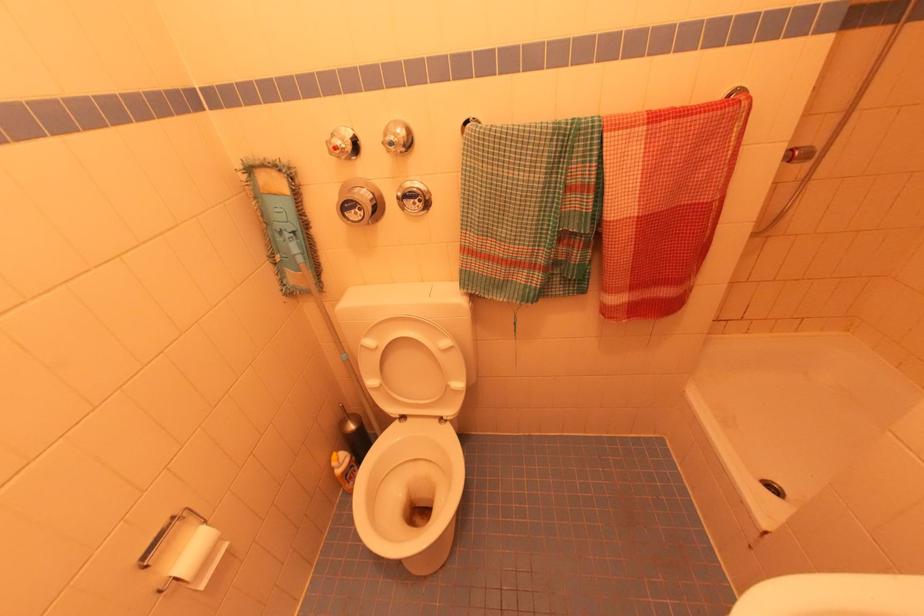
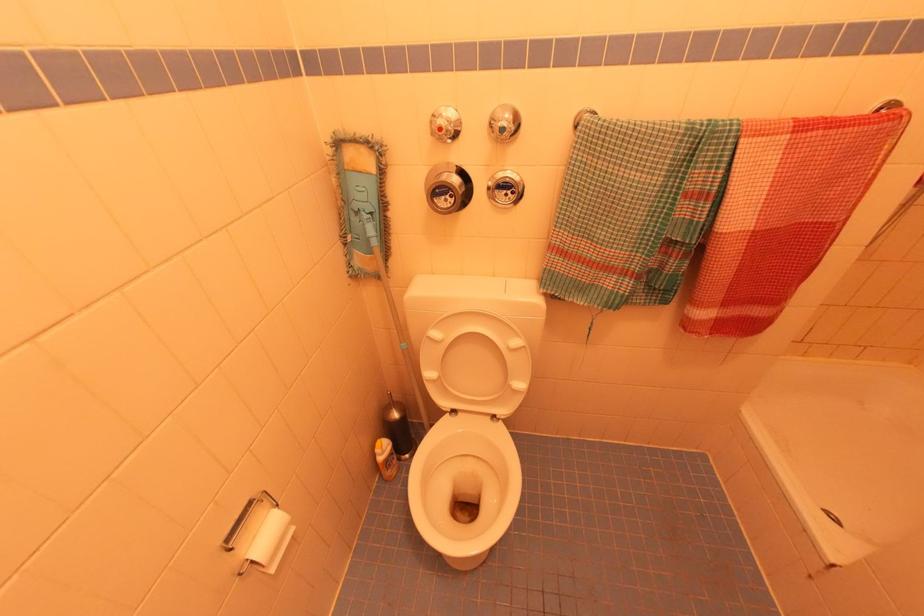
Where in the second image is the point corresponding to pixel 367 338 from the first image?

(433, 329)